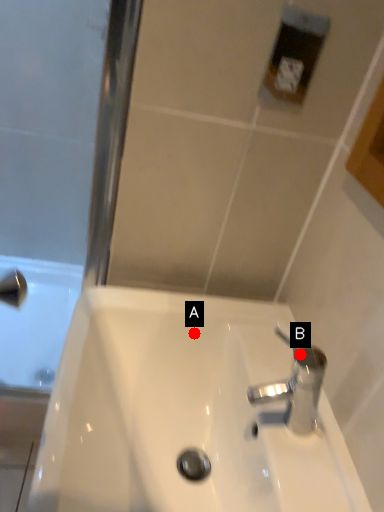
Question: Two points are circled on the image, labeled by A and B beside each circle. Which point is closer to the camera taking this photo?

Choices:
 (A) A is closer
 (B) B is closer

Answer: (B)